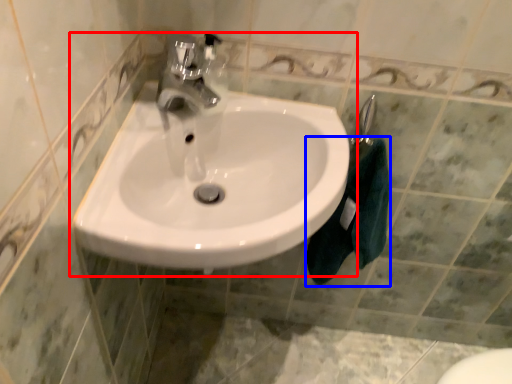
Question: Which object is further to the camera taking this photo, sink (highlighted by a red box) or bath towel (highlighted by a blue box)?

Choices:
 (A) sink
 (B) bath towel

Answer: (B)